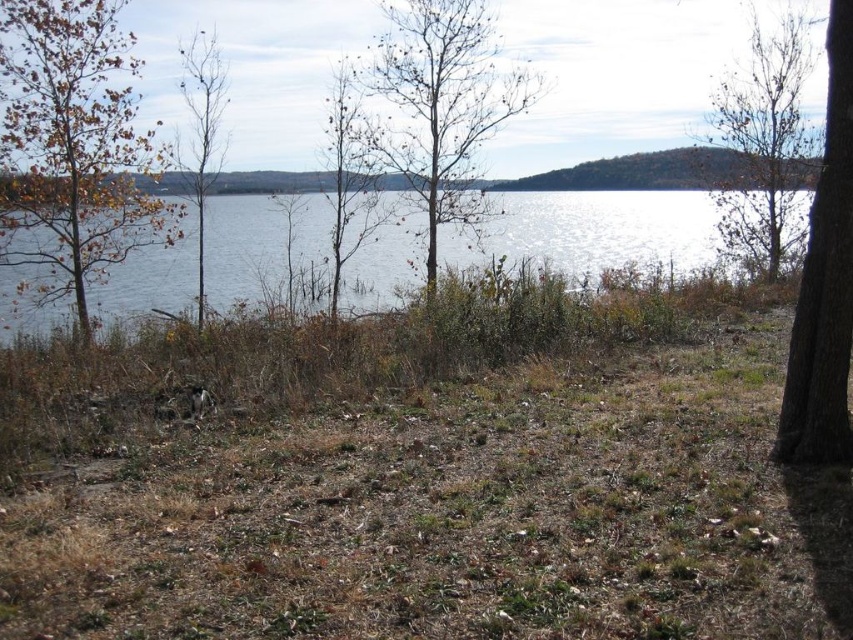
You are standing at the lakeside and want to walk to the point marked as point (x=189, y=301) and point (x=750, y=104). Which point will you reach first?

You will reach point (x=189, y=301) first because it is closer to you than point (x=750, y=104).

You are standing at the edge of the lakeside scene described. If you look towards the center of the image, where would you find the brown dry grass at center?

The brown dry grass at center is located at the coordinates point (422,477).